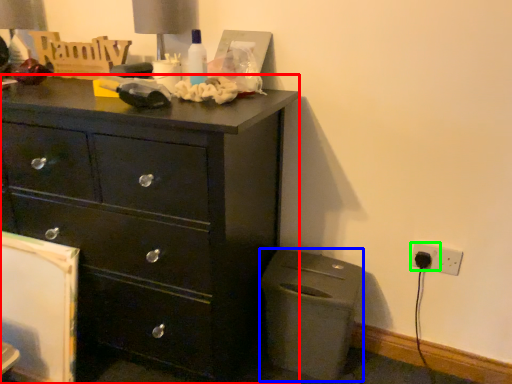
Question: Based on their relative distances, which object is farther from chest of drawers (highlighted by a red box)? Choose from cabinetry (highlighted by a blue box) and electric outlet (highlighted by a green box).

Choices:
 (A) cabinetry
 (B) electric outlet

Answer: (B)